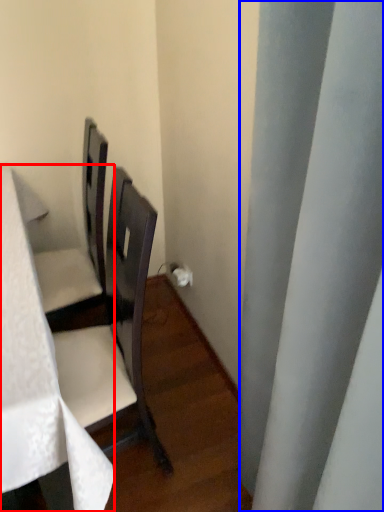
Question: Among these objects, which one is nearest to the camera, table (highlighted by a red box) or curtain (highlighted by a blue box)?

Choices:
 (A) table
 (B) curtain

Answer: (B)